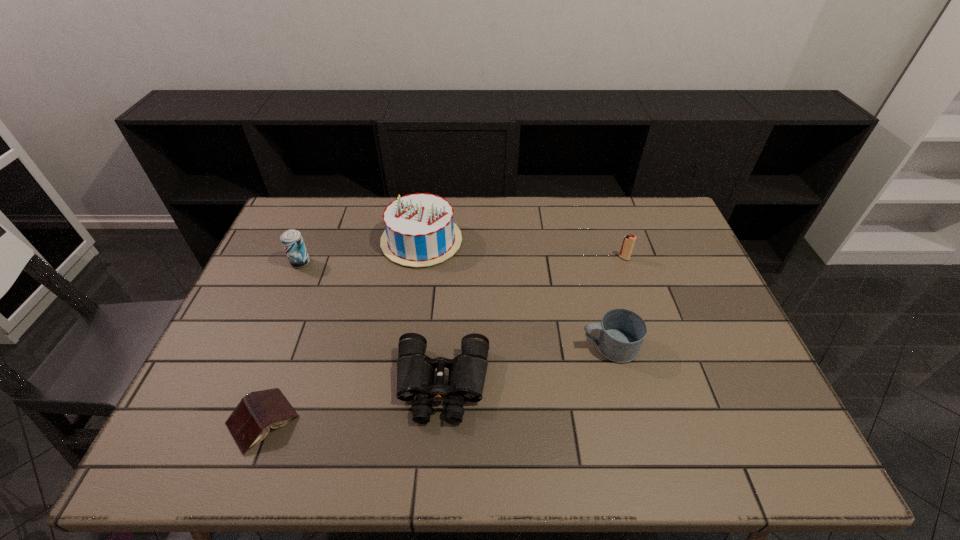
Where is `birthday cake`? birthday cake is located at coordinates (420, 231).

The width and height of the screenshot is (960, 540). What are the coordinates of `beer can` in the screenshot? It's located at (292, 241).

In order to click on igniter in this screenshot , I will do `click(628, 242)`.

Find the location of `mug`. mug is located at coordinates (621, 333).

You are a GUI agent. You are given a task and a screenshot of the screen. Output one action in this format:
    pyautogui.click(x=<x>, y=<y>)
    Task: Click on the binoculars
    
    Given the screenshot: What is the action you would take?
    pyautogui.click(x=415, y=371)

The image size is (960, 540). Find the location of `the shortest object`. the shortest object is located at coordinates (x=249, y=423).

Locate an element on the screen. vacant space situated on the front of the tallest object is located at coordinates (406, 351).

You are a GUI agent. You are given a task and a screenshot of the screen. Output one action in this format:
    pyautogui.click(x=<x>, y=<y>)
    Task: Click on the vacant space located on the right of the beer can
    Image resolution: width=960 pixels, height=540 pixels.
    Given the screenshot: What is the action you would take?
    pyautogui.click(x=423, y=262)

Where is `free region located 0.150m on the right of the igniter`? free region located 0.150m on the right of the igniter is located at coordinates (676, 258).

Identify the location of vacant space located 0.370m on the side of the mug with the handle. (x=442, y=346).